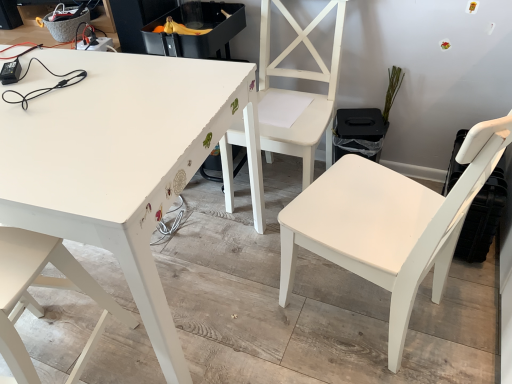
Question: Which direction should I rotate to face white matte chair at center, which is the 2th chair in left-to-right order, — up or down?

Choices:
 (A) down
 (B) up

Answer: (B)

Question: From the image's perspective, is white matte chair at lower left, which is counted as the first chair, starting from the left, located beneath white painted wood table at upper left?

Choices:
 (A) yes
 (B) no

Answer: (A)

Question: Does white matte chair at lower left, which appears as the 3th chair when viewed from the right, turn towards white painted wood table at upper left?

Choices:
 (A) no
 (B) yes

Answer: (B)

Question: Is white matte chair at lower left, which appears as the 3th chair when viewed from the right, thinner than white painted wood table at upper left?

Choices:
 (A) no
 (B) yes

Answer: (B)

Question: Is white painted wood table at upper left at the back of white matte chair at lower left, which is counted as the first chair, starting from the left?

Choices:
 (A) yes
 (B) no

Answer: (B)

Question: Is white matte chair at lower left, which appears as the 3th chair when viewed from the right, positioned behind white painted wood table at upper left?

Choices:
 (A) no
 (B) yes

Answer: (A)

Question: From a real-world perspective, is white matte chair at lower left, which is counted as the first chair, starting from the left, physically below white painted wood table at upper left?

Choices:
 (A) yes
 (B) no

Answer: (B)

Question: From the image's perspective, would you say white matte chair at center, arranged as the 3th chair when viewed from the left, is shown under white matte chair at center, the 2th chair viewed from the right?

Choices:
 (A) no
 (B) yes

Answer: (B)

Question: Is white matte chair at center, arranged as the 3th chair when viewed from the left, further to camera compared to white matte chair at center, the 2th chair viewed from the right?

Choices:
 (A) no
 (B) yes

Answer: (A)

Question: Does white matte chair at center, the first chair positioned from the right, appear on the right side of white matte chair at center, which is the 2th chair in left-to-right order?

Choices:
 (A) no
 (B) yes

Answer: (B)

Question: Can you confirm if white matte chair at center, the first chair positioned from the right, is wider than white matte chair at center, which is the 2th chair in left-to-right order?

Choices:
 (A) yes
 (B) no

Answer: (A)

Question: From a real-world perspective, is white matte chair at center, the first chair positioned from the right, located higher than white matte chair at center, the 2th chair viewed from the right?

Choices:
 (A) yes
 (B) no

Answer: (A)

Question: Is white matte chair at center, the first chair positioned from the right, located outside white matte chair at center, the 2th chair viewed from the right?

Choices:
 (A) yes
 (B) no

Answer: (A)

Question: Considering the relative positions of white matte chair at center, the 2th chair viewed from the right, and white matte chair at center, arranged as the 3th chair when viewed from the left, in the image provided, is white matte chair at center, the 2th chair viewed from the right, behind white matte chair at center, arranged as the 3th chair when viewed from the left,?

Choices:
 (A) no
 (B) yes

Answer: (B)